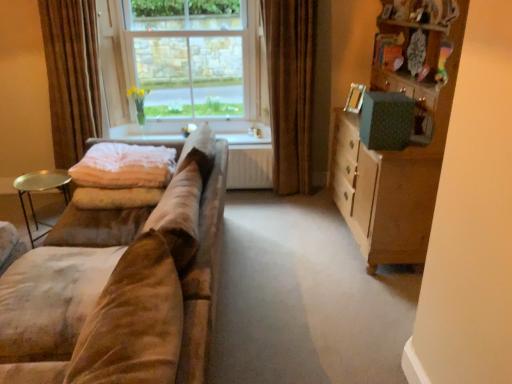
Locate an element on the screen. The image size is (512, 384). vacant space in front of wooden cabinet at right is located at coordinates (344, 303).